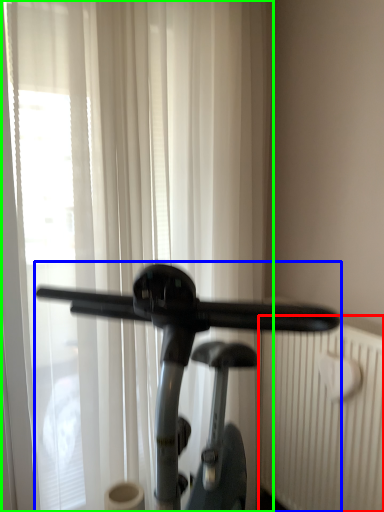
Question: Which is farther away from radiator (highlighted by a red box)? stationary bicycle (highlighted by a blue box) or curtain (highlighted by a green box)?

Choices:
 (A) stationary bicycle
 (B) curtain

Answer: (B)